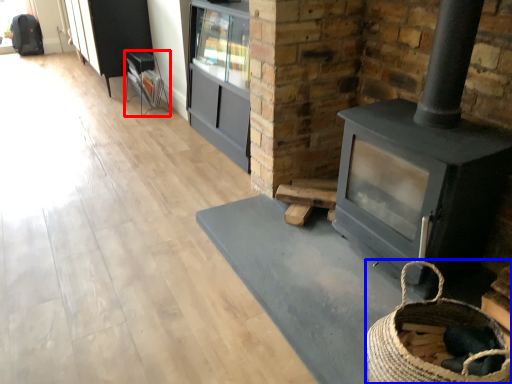
Question: Among these objects, which one is nearest to the camera, furniture (highlighted by a red box) or basket (highlighted by a blue box)?

Choices:
 (A) furniture
 (B) basket

Answer: (B)